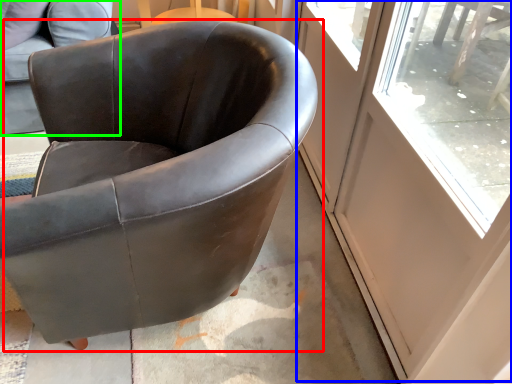
Question: Estimate the real-world distances between objects in this image. Which object is closer to chair (highlighted by a red box), screen door (highlighted by a blue box) or chair (highlighted by a green box)?

Choices:
 (A) screen door
 (B) chair

Answer: (B)